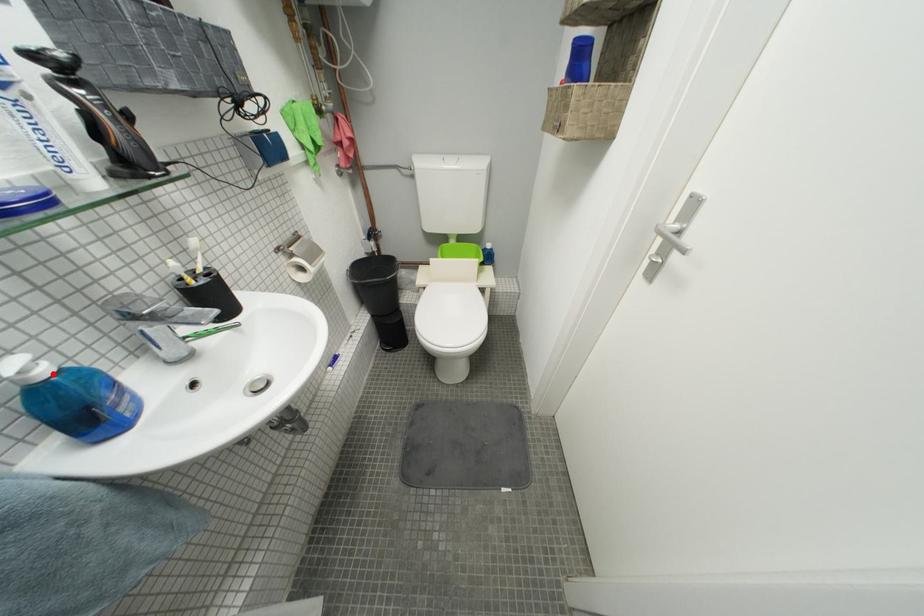
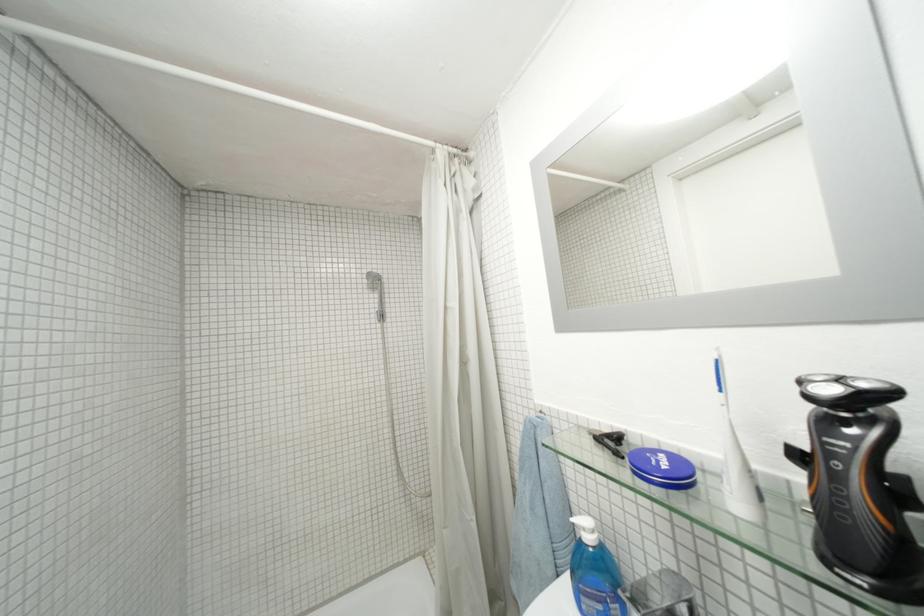
The point at the highlighted location is marked in the first image. Where is the corresponding point in the second image?

(598, 541)